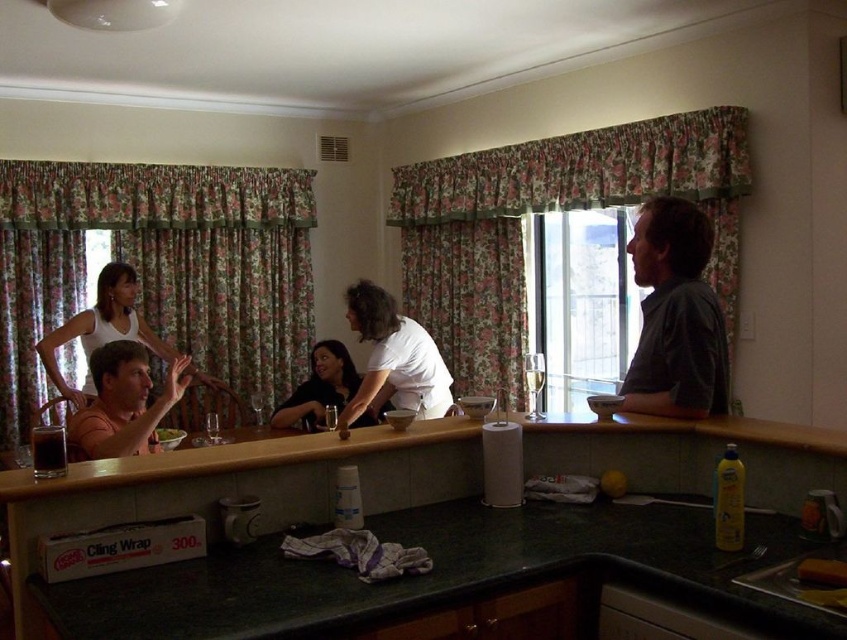
Who is positioned more to the right, white fabric shirt at upper left or black plastic sink at lower right?

From the viewer's perspective, black plastic sink at lower right appears more on the right side.

Looking at this image, is white fabric shirt at upper left taller than black plastic sink at lower right?

Yes, white fabric shirt at upper left is taller than black plastic sink at lower right.

Is point (115, 262) behind point (793, 595)?

Yes, point (115, 262) is farther from viewer.

Identify the location of white fabric shirt at upper left. (101, 330).

Looking at this image, can you confirm if matte black shirt at center is taller than black plastic sink at lower right?

Yes, matte black shirt at center is taller than black plastic sink at lower right.

Which is more to the right, matte black shirt at center or black plastic sink at lower right?

black plastic sink at lower right

Is point (336, 344) closer to viewer compared to point (789, 564)?

That is False.

Where is `matte black shirt at center`? The image size is (847, 640). matte black shirt at center is located at coordinates (319, 387).

Consider the image. Who is higher up, green marble countertop at center or white matte shirt at center?

white matte shirt at center

Does point (302, 442) come in front of point (375, 308)?

Yes.

Where is `green marble countertop at center`? The image size is (847, 640). green marble countertop at center is located at coordinates (241, 484).